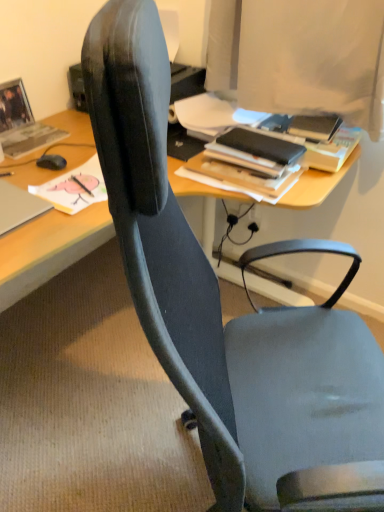
Question: Considering the relative sizes of matte black book at upper left, the second book positioned from the left, and black matte mouse at left in the image provided, is matte black book at upper left, the second book positioned from the left, smaller than black matte mouse at left?

Choices:
 (A) no
 (B) yes

Answer: (A)

Question: Considering the relative positions of matte black book at upper left, the second book positioned from the left, and black matte mouse at left in the image provided, is matte black book at upper left, the second book positioned from the left, to the right of black matte mouse at left from the viewer's perspective?

Choices:
 (A) yes
 (B) no

Answer: (A)

Question: Is matte black book at upper left, the second book positioned from the left, to the left of black matte mouse at left from the viewer's perspective?

Choices:
 (A) yes
 (B) no

Answer: (B)

Question: From the image's perspective, is matte black book at upper left, positioned as the 2th book in right-to-left order, below black matte mouse at left?

Choices:
 (A) yes
 (B) no

Answer: (A)

Question: Is matte black book at upper left, the second book positioned from the left, not within black matte mouse at left?

Choices:
 (A) yes
 (B) no

Answer: (A)

Question: Can you confirm if matte black book at upper left, positioned as the 2th book in right-to-left order, is thinner than black matte mouse at left?

Choices:
 (A) no
 (B) yes

Answer: (A)

Question: Does black matte mouse at left have a larger size compared to matte black book at upper left, the second book positioned from the left?

Choices:
 (A) no
 (B) yes

Answer: (A)

Question: Does black matte mouse at left have a lesser width compared to matte black book at upper left, positioned as the 2th book in right-to-left order?

Choices:
 (A) no
 (B) yes

Answer: (B)

Question: Considering the relative sizes of black matte mouse at left and matte black book at upper left, the second book positioned from the left, in the image provided, is black matte mouse at left wider than matte black book at upper left, the second book positioned from the left,?

Choices:
 (A) no
 (B) yes

Answer: (A)

Question: Considering the relative sizes of black matte mouse at left and matte black book at upper left, positioned as the 2th book in right-to-left order, in the image provided, is black matte mouse at left smaller than matte black book at upper left, positioned as the 2th book in right-to-left order,?

Choices:
 (A) no
 (B) yes

Answer: (B)

Question: Is black matte mouse at left with matte black book at upper left, the second book positioned from the left?

Choices:
 (A) no
 (B) yes

Answer: (A)

Question: From a real-world perspective, is black matte mouse at left under matte black book at upper left, the second book positioned from the left?

Choices:
 (A) no
 (B) yes

Answer: (A)

Question: Is matte gray book at upper left, arranged as the 3th book when viewed from the right, closer to camera compared to black matte mouse at left?

Choices:
 (A) yes
 (B) no

Answer: (B)